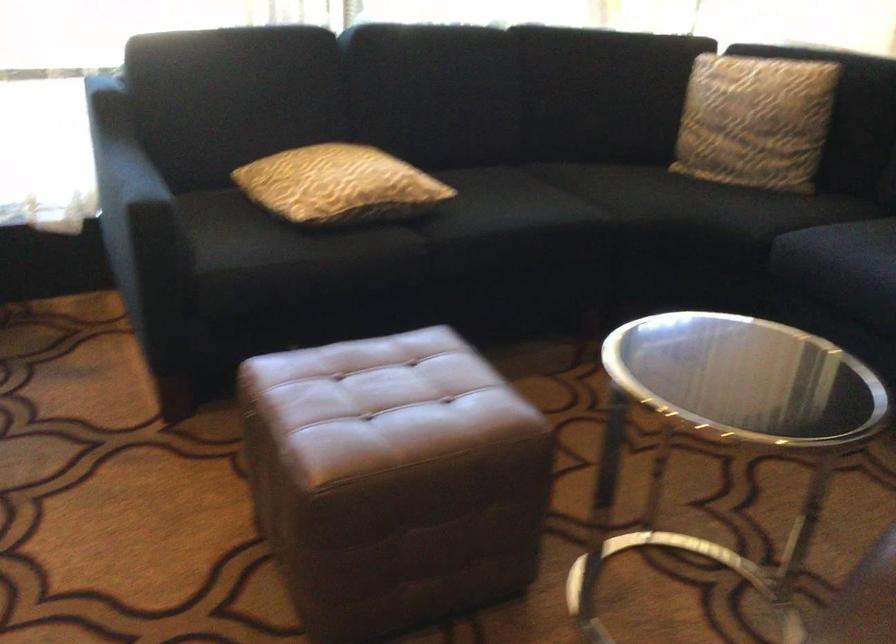
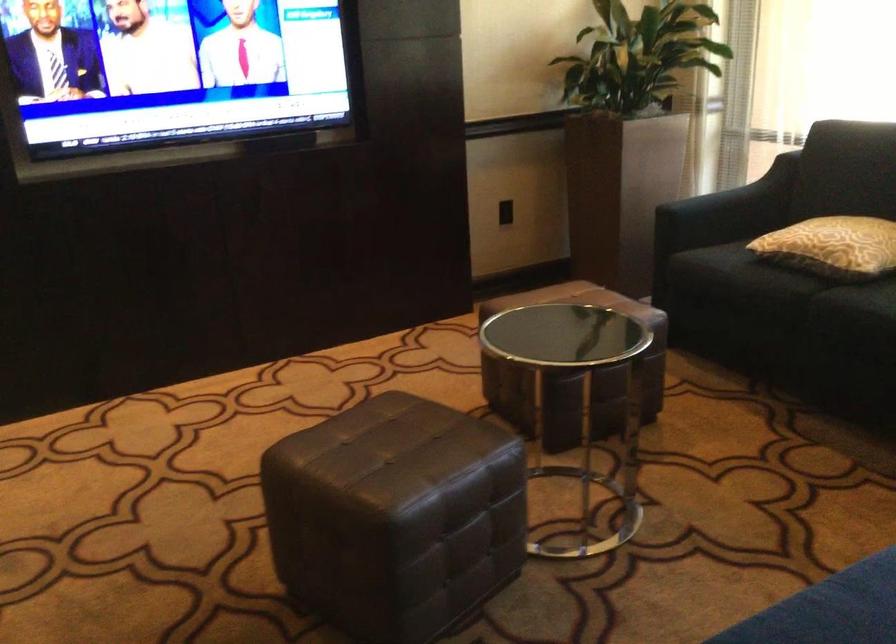
The point at (409, 187) is marked in the first image. Where is the corresponding point in the second image?

(832, 245)